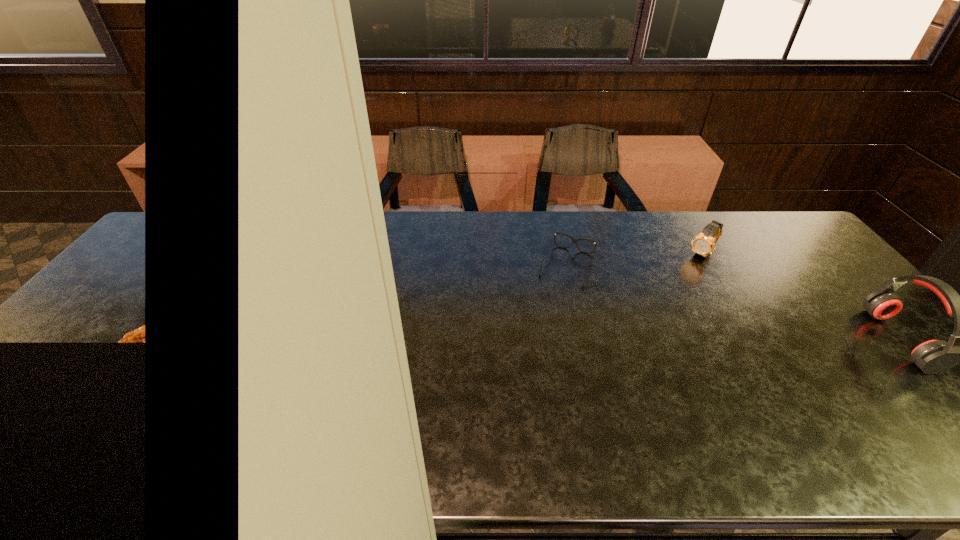
In the image, there is a desktop. Identify the location of vacant space at the left edge. This screenshot has height=540, width=960. (76, 344).

In the image, there is a desktop. Identify the location of free space at the right edge. (803, 289).

Locate an element on the screen. This screenshot has height=540, width=960. vacant space at the far left corner of the desktop is located at coordinates (162, 242).

Locate an element on the screen. The height and width of the screenshot is (540, 960). vacant space at the far right corner of the desktop is located at coordinates (782, 238).

Identify the location of vacant space in between the earphone and the watch. Image resolution: width=960 pixels, height=540 pixels. (801, 297).

This screenshot has height=540, width=960. I want to click on free space between the second object from right to left and the tallest object, so click(x=801, y=297).

Where is `free space between the tallest object and the shortest object`? Image resolution: width=960 pixels, height=540 pixels. free space between the tallest object and the shortest object is located at coordinates (732, 302).

This screenshot has height=540, width=960. Identify the location of object that is the closest one to the nearest object. (703, 244).

Identify which object is the closest to the shortest object. Please provide its 2D coordinates. Your answer should be formatted as a tuple, i.e. [(x, y)], where the tuple contains the x and y coordinates of a point satisfying the conditions above.

[(703, 244)]

Locate an element on the screen. This screenshot has height=540, width=960. blank area in the image that satisfies the following two spatial constraints: 1. on the back side of the watch; 2. on the left side of the leftmost object is located at coordinates (564, 254).